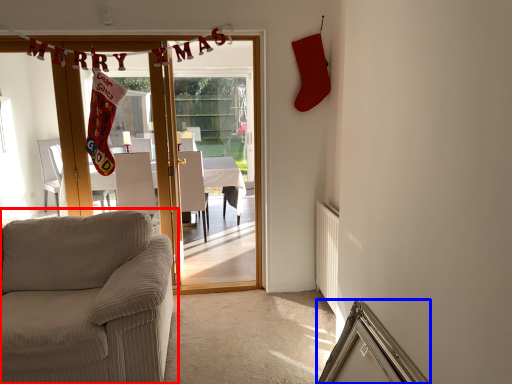
Question: Among these objects, which one is nearest to the camera, studio couch (highlighted by a red box) or picture frame (highlighted by a blue box)?

Choices:
 (A) studio couch
 (B) picture frame

Answer: (B)